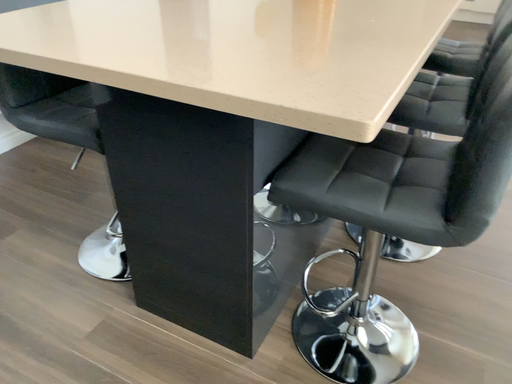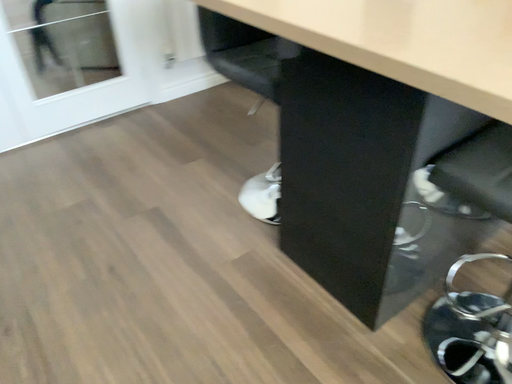
Question: How did the camera likely rotate when shooting the video?

Choices:
 (A) rotated right
 (B) rotated left

Answer: (B)